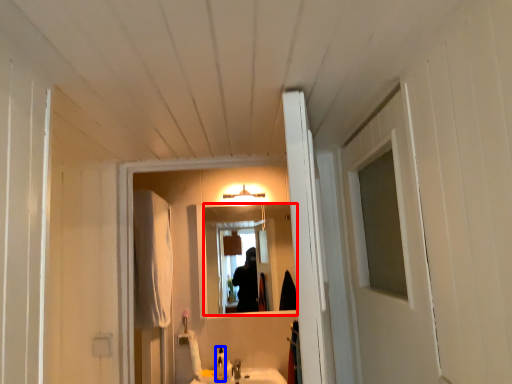
Question: Which object appears closest to the camera in this image, mirror (highlighted by a red box) or bottle (highlighted by a blue box)?

Choices:
 (A) mirror
 (B) bottle

Answer: (B)